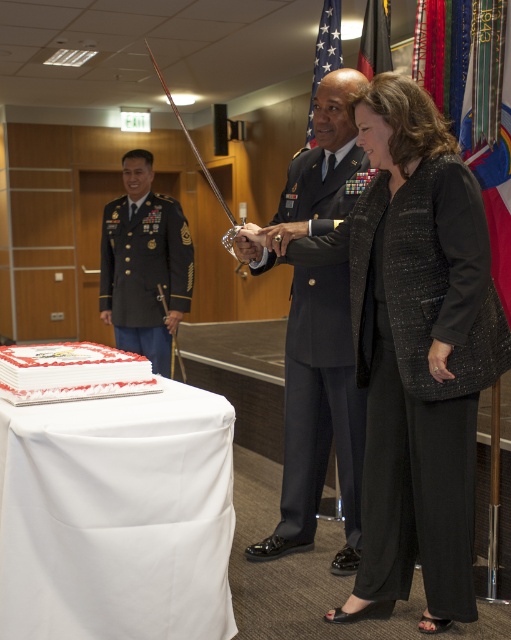
You are an event planner observing the formal event. You need to determine which attendee has a wider garment based on their clothing. Which one has a wider garment between the black textured suit at center and the navy blue fabric uniform at center?

The black textured suit at center has a greater width than the navy blue fabric uniform at center according to the description provided.

Please look at the image and identify the object located at the coordinates point (x=423, y=378). The objects in the image are the rectangular cake with white frosting and red decorative borders placed on a table covered with a white cloth and the black textured pants at lower right. Which one is at the specified coordinates?

The black textured pants at lower right is located at point (x=423, y=378).

You are attending a formal military ceremony and see the black textured pants at lower right and the green military uniform at left. Which one is located to the right side of the other?

The black textured pants at lower right is positioned on the right side of green military uniform at left.